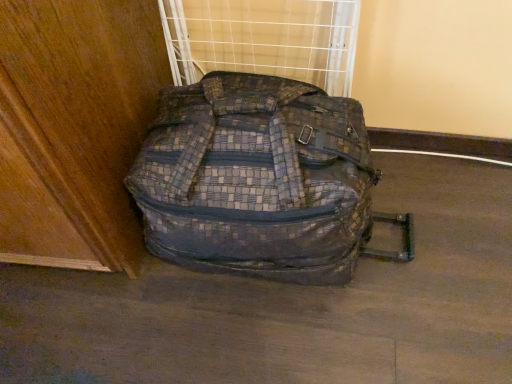
Image resolution: width=512 pixels, height=384 pixels. What do you see at coordinates (263, 39) in the screenshot? I see `transparent plastic bag at center` at bounding box center [263, 39].

I want to click on transparent plastic bag at center, so click(263, 39).

Image resolution: width=512 pixels, height=384 pixels. In order to click on transparent plastic bag at center in this screenshot , I will do `click(263, 39)`.